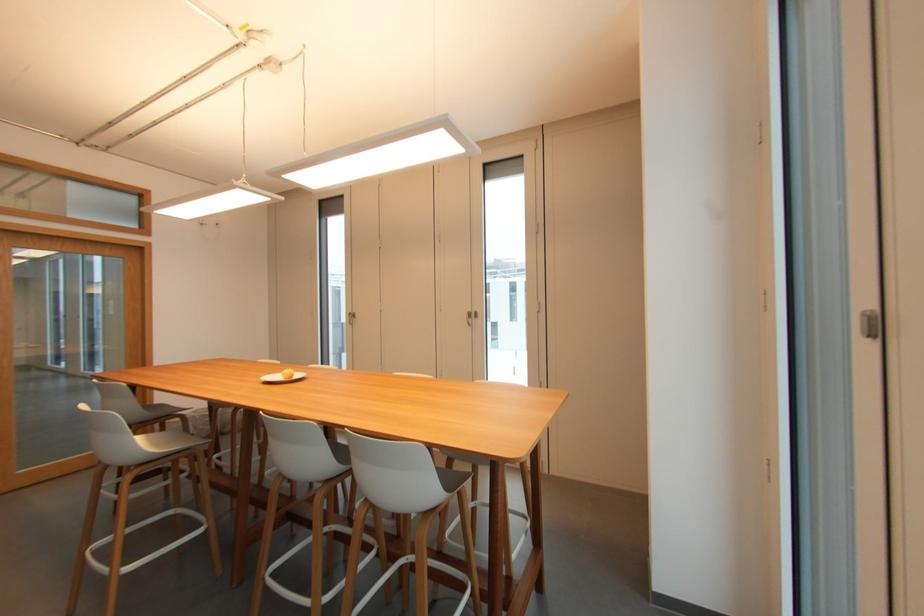
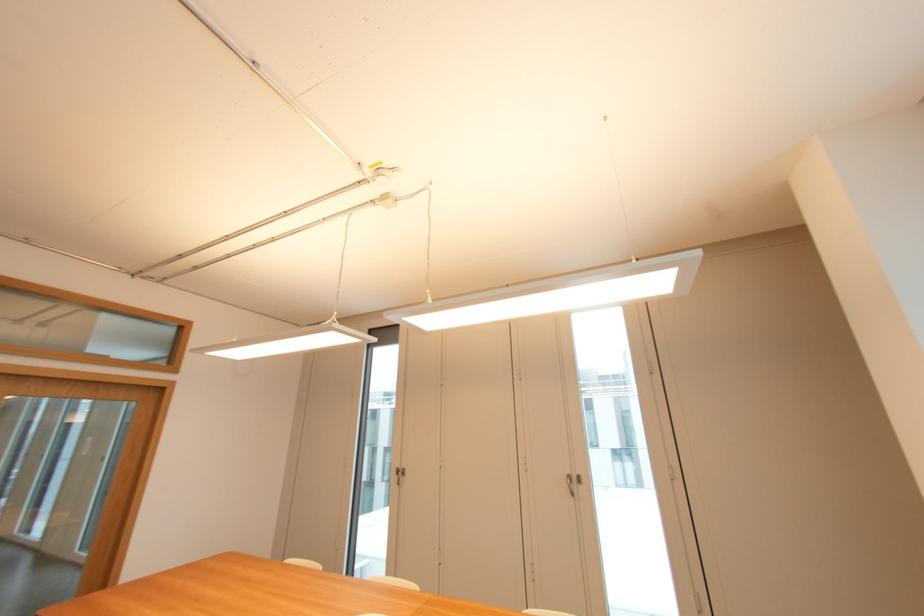
The images are taken continuously from a first-person perspective. In which direction are you moving?

The cameraman walked toward left, forward.